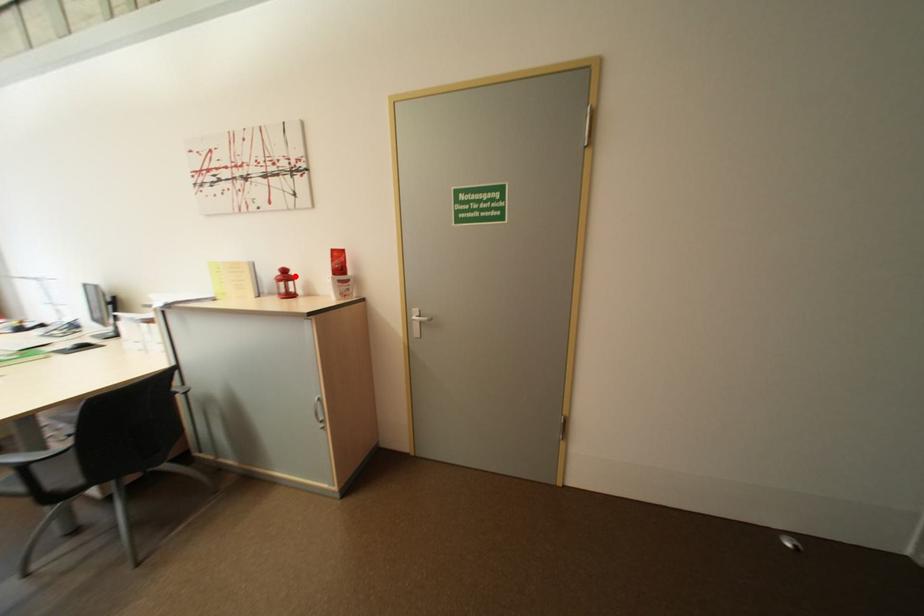
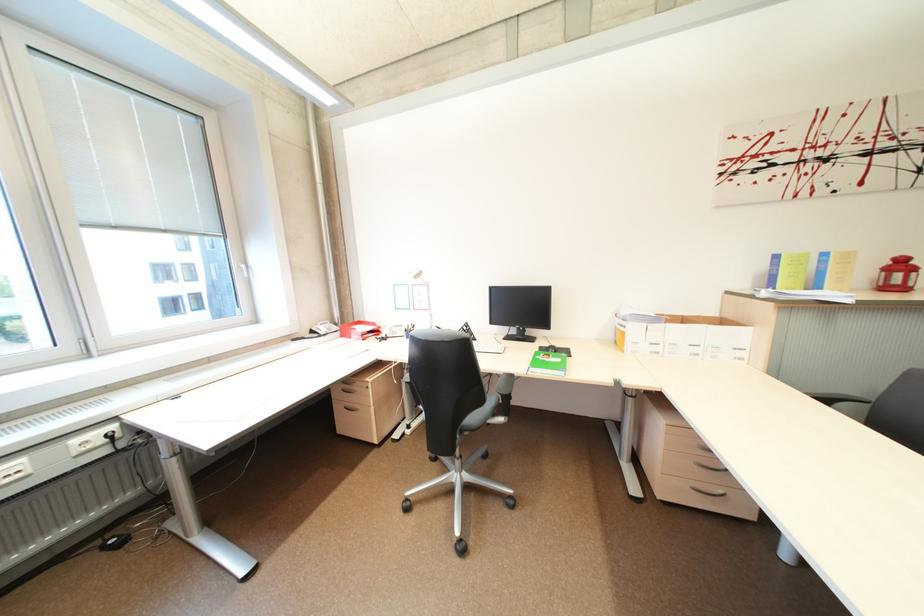
In the second image, find the point that corresponds to the highlighted location in the first image.

(910, 265)